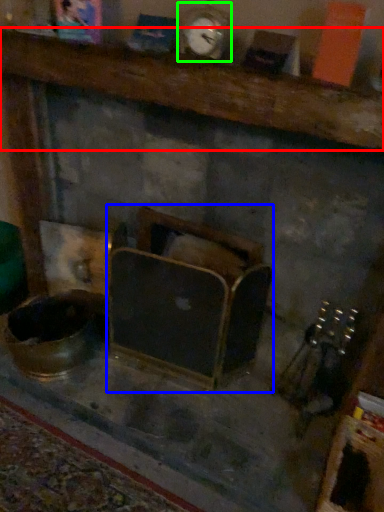
Question: Which object is positioned closest to furniture (highlighted by a red box)? Select from furniture (highlighted by a blue box) and clock (highlighted by a green box).

Choices:
 (A) furniture
 (B) clock

Answer: (B)